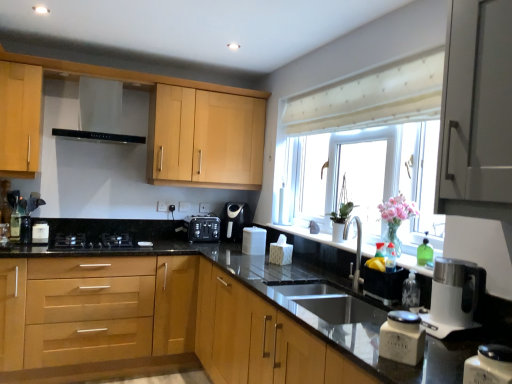
Question: Is pink glass vase at window touching white plastic kettle at right?

Choices:
 (A) yes
 (B) no

Answer: (B)

Question: Does pink glass vase at window lie in front of white plastic kettle at right?

Choices:
 (A) no
 (B) yes

Answer: (A)

Question: From a real-world perspective, does pink glass vase at window sit lower than white plastic kettle at right?

Choices:
 (A) no
 (B) yes

Answer: (A)

Question: From the image's perspective, is pink glass vase at window located beneath white plastic kettle at right?

Choices:
 (A) yes
 (B) no

Answer: (B)

Question: Is pink glass vase at window at the right side of white plastic kettle at right?

Choices:
 (A) yes
 (B) no

Answer: (B)

Question: Does pink glass vase at window have a lesser height compared to white plastic kettle at right?

Choices:
 (A) yes
 (B) no

Answer: (B)

Question: Is white plastic container at center, which ranks as the 1th appliance in right-to-left order, a part of white fabric at upper center?

Choices:
 (A) yes
 (B) no

Answer: (B)

Question: From the image's perspective, is white fabric at upper center located above white plastic container at center, which ranks as the 1th appliance in right-to-left order?

Choices:
 (A) yes
 (B) no

Answer: (A)

Question: Is white fabric at upper center at the left side of white plastic container at center, which is counted as the 2th appliance, starting from the left?

Choices:
 (A) yes
 (B) no

Answer: (B)

Question: Does white fabric at upper center have a larger size compared to white plastic container at center, which is counted as the 2th appliance, starting from the left?

Choices:
 (A) no
 (B) yes

Answer: (B)

Question: From a real-world perspective, is white fabric at upper center positioned over white plastic container at center, which is counted as the 2th appliance, starting from the left, based on gravity?

Choices:
 (A) yes
 (B) no

Answer: (A)

Question: Can you confirm if white fabric at upper center is taller than white plastic container at center, the second appliance viewed from the back?

Choices:
 (A) yes
 (B) no

Answer: (A)

Question: Would you say satin black coffee machine at center is a long distance from clear plastic bottle at sink right, which is the 2th bottle from back to front?

Choices:
 (A) yes
 (B) no

Answer: (A)